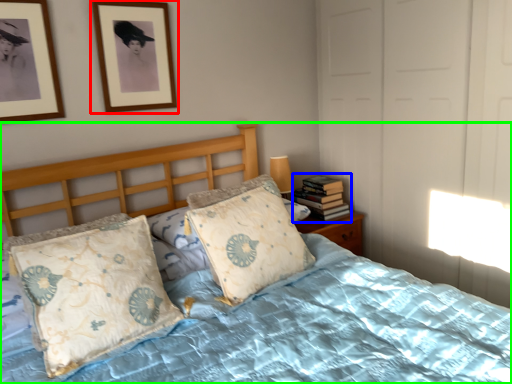
Question: Based on their relative distances, which object is farther from picture frame (highlighted by a red box)? Choose from book (highlighted by a blue box) and bed (highlighted by a green box).

Choices:
 (A) book
 (B) bed

Answer: (B)